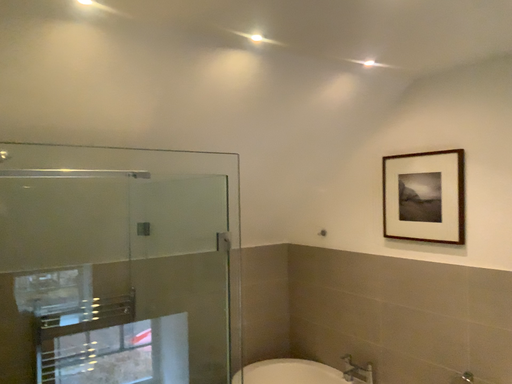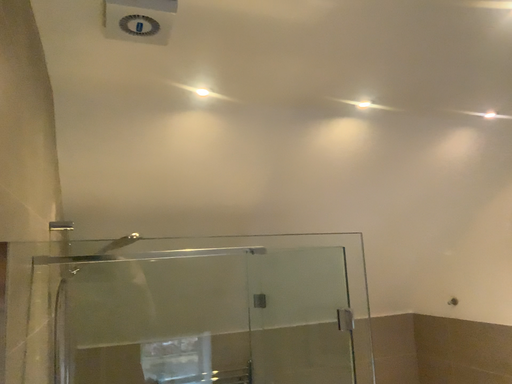
Question: Which way did the camera rotate in the video?

Choices:
 (A) rotated upward
 (B) rotated downward

Answer: (A)